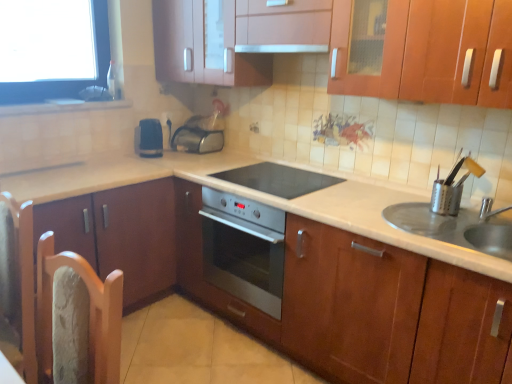
Where is `metallic silver utensil holder at right, the 3th appliance when ordered from top to bottom`? Image resolution: width=512 pixels, height=384 pixels. metallic silver utensil holder at right, the 3th appliance when ordered from top to bottom is located at coordinates (446, 198).

What do you see at coordinates (166, 119) in the screenshot?
I see `metallic silver outlet at center` at bounding box center [166, 119].

Locate an element on the screen. This screenshot has height=384, width=512. wooden chair at left is located at coordinates (17, 286).

Find the location of `silver metallic sink at lower right`. silver metallic sink at lower right is located at coordinates (454, 228).

What is the approximate height of wooden cabinet at upper center, positioned as the first cabinetry in right-to-left order?

53.59 centimeters.

I want to click on metallic silver utensil holder at right, which is the 1th appliance from bottom to top, so click(x=446, y=198).

Is black plastic toaster at center, the 1th appliance positioned from the left, shorter than white glossy countertop at center?

Indeed, black plastic toaster at center, the 1th appliance positioned from the left, has a lesser height compared to white glossy countertop at center.

Considering the sizes of objects black plastic toaster at center, the second appliance positioned from the bottom, and white glossy countertop at center in the image provided, who is smaller, black plastic toaster at center, the second appliance positioned from the bottom, or white glossy countertop at center?

With smaller size is black plastic toaster at center, the second appliance positioned from the bottom.

What are the coordinates of `appliance that is the 2nd one when counting backward from the white glossy countertop at center` in the screenshot? It's located at (149, 138).

In the image, is black plastic toaster at center, marked as the 2th appliance in a front-to-back arrangement, positioned in front of or behind white glossy countertop at center?

black plastic toaster at center, marked as the 2th appliance in a front-to-back arrangement, is behind white glossy countertop at center.

Is metallic silver utensil holder at right, the third appliance viewed from the back, inside or outside of wooden cabinet at left, arranged as the 1th cabinetry when viewed from the left?

metallic silver utensil holder at right, the third appliance viewed from the back, exists outside the volume of wooden cabinet at left, arranged as the 1th cabinetry when viewed from the left.

In the scene shown: Considering the sizes of objects metallic silver utensil holder at right, which is the third appliance in left-to-right order, and wooden cabinet at left, which ranks as the 2th cabinetry in right-to-left order, in the image provided, who is wider, metallic silver utensil holder at right, which is the third appliance in left-to-right order, or wooden cabinet at left, which ranks as the 2th cabinetry in right-to-left order,?

wooden cabinet at left, which ranks as the 2th cabinetry in right-to-left order, is wider.

How distant is metallic silver utensil holder at right, which is the third appliance in left-to-right order, from wooden cabinet at left, which ranks as the 2th cabinetry in right-to-left order?

They are 5.21 feet apart.

How different are the orientations of metallic silver utensil holder at right, the 3th appliance when ordered from top to bottom, and wooden cabinet at left, arranged as the 1th cabinetry when viewed from the left, in degrees?

121 degrees.

Is black plastic toaster at center, the 1th appliance positioned from the left, smaller than black glass cooktop at center?

Yes.

Considering the sizes of black plastic toaster at center, marked as the 2th appliance in a front-to-back arrangement, and black glass cooktop at center in the image, is black plastic toaster at center, marked as the 2th appliance in a front-to-back arrangement, wider or thinner than black glass cooktop at center?

Considering their sizes, black plastic toaster at center, marked as the 2th appliance in a front-to-back arrangement, looks slimmer than black glass cooktop at center.

Which of these two, black plastic toaster at center, the second appliance positioned from the bottom, or black glass cooktop at center, stands taller?

Standing taller between the two is black plastic toaster at center, the second appliance positioned from the bottom.

Is black plastic toaster at center, the second appliance positioned from the bottom, completely or partially outside of black glass cooktop at center?

Yes, black plastic toaster at center, the second appliance positioned from the bottom, is located beyond the bounds of black glass cooktop at center.

From a real-world perspective, which object stands above the other?

black plastic toaster at center, marked as the 2th appliance in a front-to-back arrangement.

Looking at this image, can you confirm if black plastic toaster at center, positioned as the 3th appliance in right-to-left order, is bigger than wooden chair at left?

No, black plastic toaster at center, positioned as the 3th appliance in right-to-left order, is not bigger than wooden chair at left.

The width and height of the screenshot is (512, 384). Find the location of `chair lying in front of the black plastic toaster at center, the 2th appliance viewed from the top`. chair lying in front of the black plastic toaster at center, the 2th appliance viewed from the top is located at coordinates [x=17, y=286].

Does point (158, 145) come in front of point (31, 380)?

That is False.

Consider the image. In the image, is white glossy exhaust hood at upper center on the left side or the right side of silver metallic sink at lower right?

white glossy exhaust hood at upper center is to the left of silver metallic sink at lower right.

Is white glossy exhaust hood at upper center oriented towards silver metallic sink at lower right?

No, white glossy exhaust hood at upper center is not aimed at silver metallic sink at lower right.

From the image's perspective, which object appears higher, white glossy exhaust hood at upper center or silver metallic sink at lower right?

white glossy exhaust hood at upper center is shown above in the image.

Is wooden chair at left far from metallic silver toaster at center, which is the 3th appliance from bottom to top?

Yes.

Would you say metallic silver toaster at center, positioned as the first appliance in back-to-front order, is part of wooden chair at left's contents?

No, metallic silver toaster at center, positioned as the first appliance in back-to-front order, is not a part of wooden chair at left.

From a real-world perspective, is wooden chair at left physically below metallic silver toaster at center, which is the 3th appliance from bottom to top?

Indeed, from a real-world perspective, wooden chair at left is positioned beneath metallic silver toaster at center, which is the 3th appliance from bottom to top.

Considering the sizes of objects metallic silver toaster at center, which is the 3th appliance from bottom to top, and white glossy countertop at center in the image provided, who is shorter, metallic silver toaster at center, which is the 3th appliance from bottom to top, or white glossy countertop at center?

With less height is metallic silver toaster at center, which is the 3th appliance from bottom to top.

From a real-world perspective, is metallic silver toaster at center, acting as the second appliance starting from the left, above or below white glossy countertop at center?

From a real-world perspective, metallic silver toaster at center, acting as the second appliance starting from the left, is physically above white glossy countertop at center.

From the image's perspective, is metallic silver toaster at center, the second appliance in the right-to-left sequence, located above white glossy countertop at center?

Yes.

Is metallic silver toaster at center, acting as the second appliance starting from the left, wider than white glossy countertop at center?

No, metallic silver toaster at center, acting as the second appliance starting from the left, is not wider than white glossy countertop at center.

Where is `the 2nd appliance counting from the left of the white glossy countertop at center`? The image size is (512, 384). the 2nd appliance counting from the left of the white glossy countertop at center is located at coordinates (149, 138).

Where is `cabinetry below the metallic silver utensil holder at right, arranged as the 1th appliance when viewed from the front (from a real-world perspective)`? The width and height of the screenshot is (512, 384). cabinetry below the metallic silver utensil holder at right, arranged as the 1th appliance when viewed from the front (from a real-world perspective) is located at coordinates (120, 235).

Looking at the image, which one is located further to silver metallic sink at lower right, white glossy countertop at center or metallic silver toaster at center, which appears as the third appliance when viewed from the front?

Based on the image, metallic silver toaster at center, which appears as the third appliance when viewed from the front, appears to be further to silver metallic sink at lower right.

Which object lies further to the anchor point black plastic toaster at center, positioned as the 3th appliance in right-to-left order, silver metallic sink at lower right or metallic silver utensil holder at right, which is the third appliance in left-to-right order?

silver metallic sink at lower right is further to black plastic toaster at center, positioned as the 3th appliance in right-to-left order.

When comparing their distances from black glass cooktop at center, does white glossy countertop at center or metallic silver toaster at center, positioned as the first appliance in back-to-front order, seem further?

metallic silver toaster at center, positioned as the first appliance in back-to-front order, lies further to black glass cooktop at center than the other object.

Looking at the image, which one is located closer to metallic silver utensil holder at right, the 3th appliance when ordered from top to bottom, black plastic toaster at center, positioned as the 3th appliance in right-to-left order, or metallic silver outlet at center?

Among the two, black plastic toaster at center, positioned as the 3th appliance in right-to-left order, is located nearer to metallic silver utensil holder at right, the 3th appliance when ordered from top to bottom.

Consider the image. When comparing their distances from black glass cooktop at center, does metallic silver toaster at center, positioned as the first appliance in back-to-front order, or wooden chair at left seem closer?

metallic silver toaster at center, positioned as the first appliance in back-to-front order, is positioned closer to the anchor black glass cooktop at center.

Which object lies further to the anchor point white glossy countertop at center, metallic silver outlet at center or silver metallic sink at lower right?

The object further to white glossy countertop at center is metallic silver outlet at center.

Based on their spatial positions, is wooden cabinet at upper center, placed as the first cabinetry when sorted from top to bottom, or wooden chair at left closer to black plastic toaster at center, the 2th appliance viewed from the top?

wooden cabinet at upper center, placed as the first cabinetry when sorted from top to bottom, is positioned closer to the anchor black plastic toaster at center, the 2th appliance viewed from the top.

Considering their positions, is silver metallic sink at lower right positioned further to metallic silver toaster at center, acting as the second appliance starting from the left, than black plastic toaster at center, positioned as the 3th appliance in right-to-left order?

silver metallic sink at lower right is positioned further to the anchor metallic silver toaster at center, acting as the second appliance starting from the left.

Find the location of a particular element. The width and height of the screenshot is (512, 384). gas stove positioned between white glossy exhaust hood at upper center and metallic silver toaster at center, which is the first appliance from top to bottom, from near to far is located at coordinates (278, 179).

At what (x,y) coordinates should I click in order to perform the action: click on appliance between white glossy exhaust hood at upper center and metallic silver toaster at center, which is the 3th appliance from bottom to top, from front to back. Please return your answer as a coordinate pair (x, y). The image size is (512, 384). Looking at the image, I should click on (149, 138).

I want to click on chair between wooden cabinet at left, which appears as the 2th cabinetry when viewed from the top, and white glossy countertop at center, in the horizontal direction, so click(17, 286).

Identify the location of appliance between black plastic toaster at center, marked as the 2th appliance in a front-to-back arrangement, and metallic silver outlet at center in the front-back direction. Image resolution: width=512 pixels, height=384 pixels. coord(197,140).